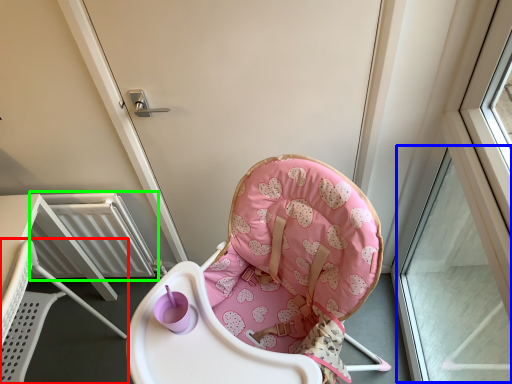
Question: Which is farther away from chair (highlighted by a red box)? window (highlighted by a blue box) or radiator (highlighted by a green box)?

Choices:
 (A) window
 (B) radiator

Answer: (A)